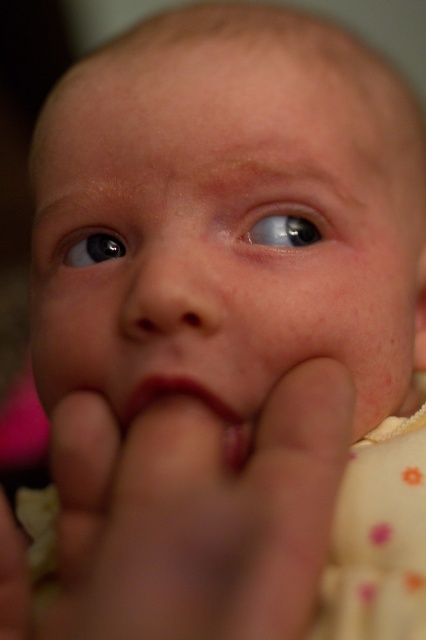
Please describe the location of the smooth skin baby face at center in the image using coordinates. The answer should be in the format of coordinates in parentheses.

The smooth skin baby face at center is located at coordinates point (x=224, y=228).

You are a photographer trying to capture the baby in the image. The client wants a closeup focusing on the baby face. Since the background is blurred, can you tell me which part of the baby is closer to the camera between the smooth skin baby face at center and the pink matte lips at center?

The smooth skin baby face at center is above the pink matte lips at center, meaning the smooth skin baby face at center is closer to the camera than the pink matte lips at center.

You are a photographer adjusting the focus on a camera to capture the baby in the scene. The smooth skin finger at lower center and the white fabric bib at lower left are both in your viewfinder. Which object should you focus on to ensure the baby remains the main subject?

The smooth skin finger at lower center is in front of the white fabric bib at lower left, so focusing on the smooth skin finger at lower center will keep the baby as the main subject since it is closer to the camera.